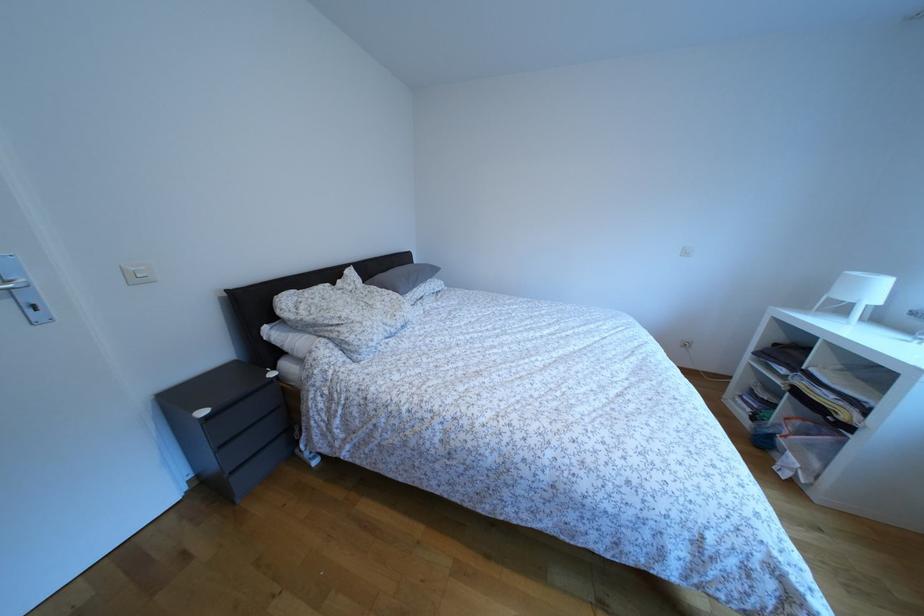
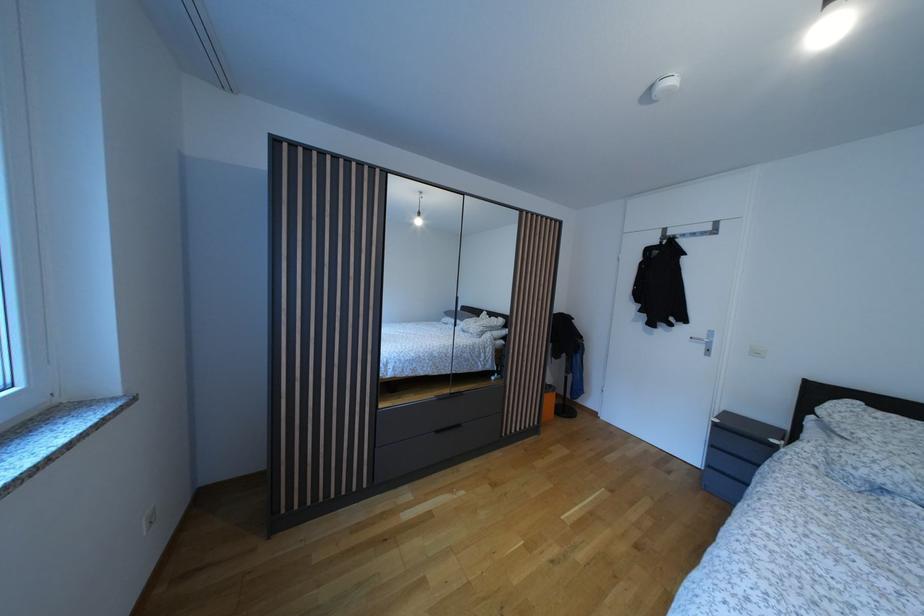
Locate, in the second image, the point that corresponds to (x=210, y=419) in the first image.

(723, 427)